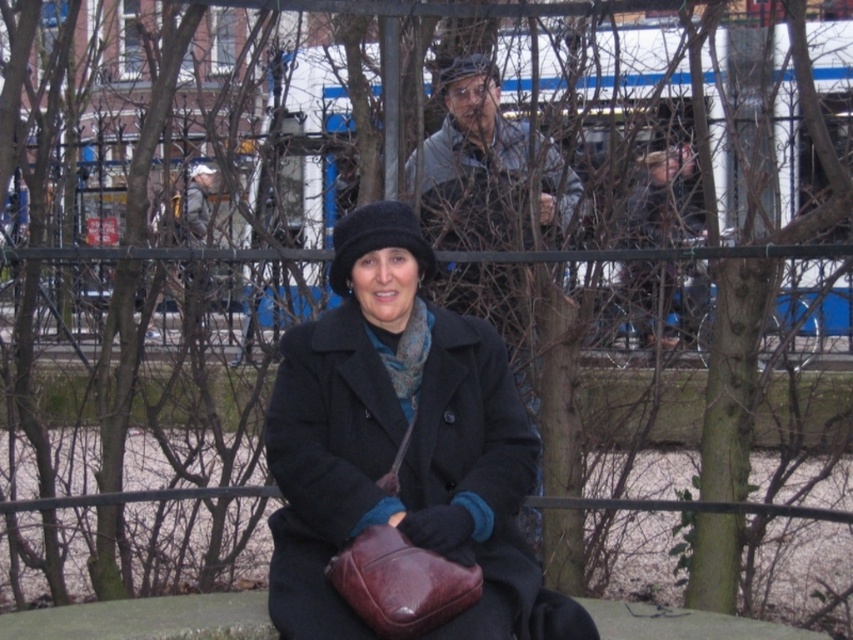
You are standing in front of the scene and want to touch the matte black coat at center and the gray woolen jacket at upper center. Which one can you reach first without moving your position?

The matte black coat at center is closer to the viewer than the gray woolen jacket at upper center, so you can reach the matte black coat at center first without moving your position.

You are a fashion stylist preparing to take a photo of a client. You have two items of clothing to position in the scene described. The client is wearing the matte black coat at center and the gray woolen jacket at upper center. Where should you place each item to ensure they are visible in the photo?

The matte black coat at center should be placed lower so it is positioned under the gray woolen jacket at upper center, ensuring both items are visible in the photo.

You are a fashion designer observing the scene. You need to determine which clothing item is shorter between the matte black coat at center and the gray woolen jacket at upper center. Can you identify which one is shorter?

The matte black coat at center is shorter than the gray woolen jacket at upper center because the description states that the matte black coat at center is not as tall as the gray woolen jacket at upper center.